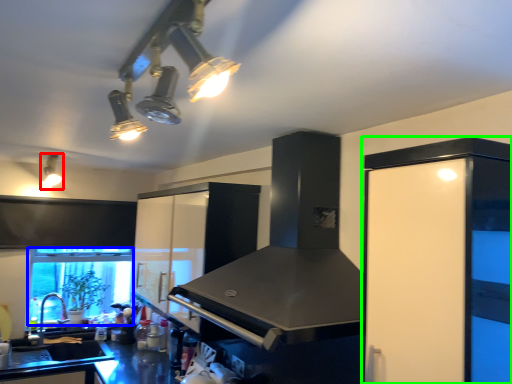
Question: Which object is the closest to the light fixture (highlighted by a red box)? Choose among these: window screen (highlighted by a blue box) or cabinetry (highlighted by a green box).

Choices:
 (A) window screen
 (B) cabinetry

Answer: (A)